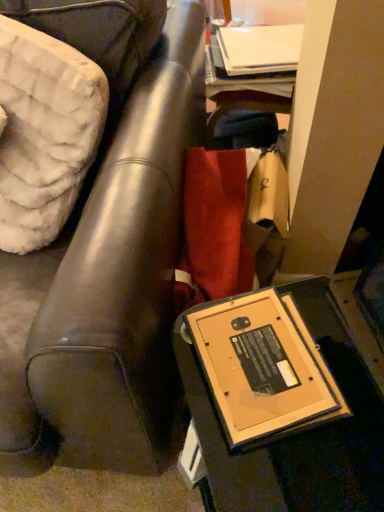
Question: From a real-world perspective, is matte black frame at lower right beneath wooden table at lower right?

Choices:
 (A) no
 (B) yes

Answer: (A)

Question: Is wooden table at lower right located within matte black frame at lower right?

Choices:
 (A) no
 (B) yes

Answer: (A)

Question: Can you see matte black frame at lower right touching wooden table at lower right?

Choices:
 (A) no
 (B) yes

Answer: (A)

Question: Does matte black frame at lower right have a greater height compared to wooden table at lower right?

Choices:
 (A) no
 (B) yes

Answer: (B)

Question: Considering the relative positions of matte black frame at lower right and wooden table at lower right in the image provided, is matte black frame at lower right to the left of wooden table at lower right from the viewer's perspective?

Choices:
 (A) yes
 (B) no

Answer: (A)

Question: Is matte black frame at lower right shorter than wooden table at lower right?

Choices:
 (A) no
 (B) yes

Answer: (A)

Question: From the image's perspective, is wooden table at lower right beneath matte black frame at lower right?

Choices:
 (A) no
 (B) yes

Answer: (B)

Question: Is wooden table at lower right taller than matte black frame at lower right?

Choices:
 (A) yes
 (B) no

Answer: (B)

Question: Does wooden table at lower right have a lesser width compared to matte black frame at lower right?

Choices:
 (A) yes
 (B) no

Answer: (A)

Question: Can you confirm if wooden table at lower right is smaller than matte black frame at lower right?

Choices:
 (A) no
 (B) yes

Answer: (B)

Question: Is wooden table at lower right located outside matte black frame at lower right?

Choices:
 (A) yes
 (B) no

Answer: (A)

Question: Is wooden table at lower right beside matte black frame at lower right?

Choices:
 (A) no
 (B) yes

Answer: (A)

Question: In terms of height, does matte black frame at lower right look taller or shorter compared to wooden table at lower right?

Choices:
 (A) short
 (B) tall

Answer: (B)